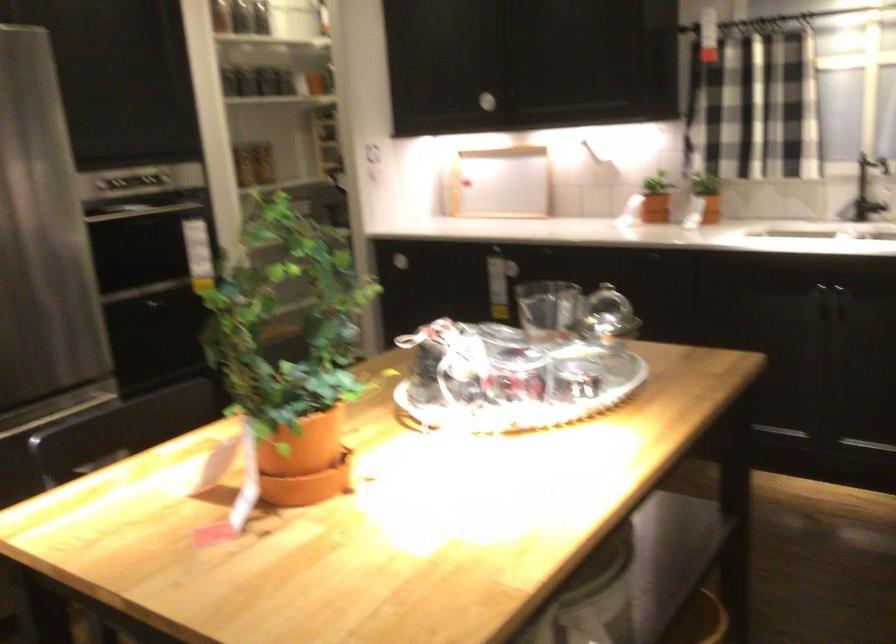
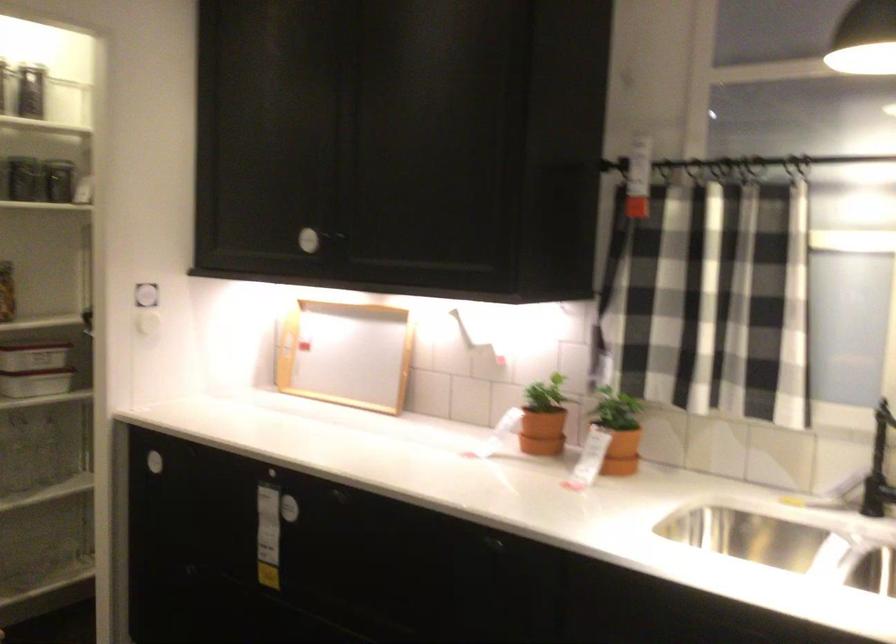
In the second image, find the point that corresponds to pixel 290 205 in the first image.

(35, 368)